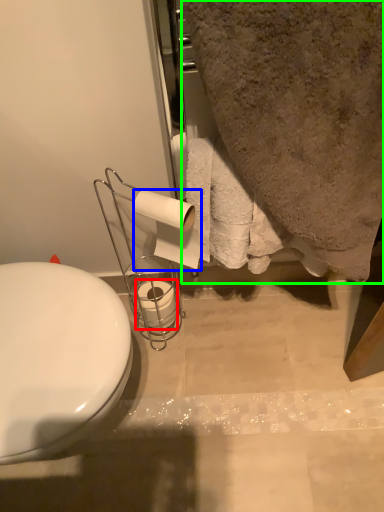
Question: Considering the real-world distances, which object is closest to toilet paper (highlighted by a red box)? toilet paper (highlighted by a blue box) or bath towel (highlighted by a green box).

Choices:
 (A) toilet paper
 (B) bath towel

Answer: (A)